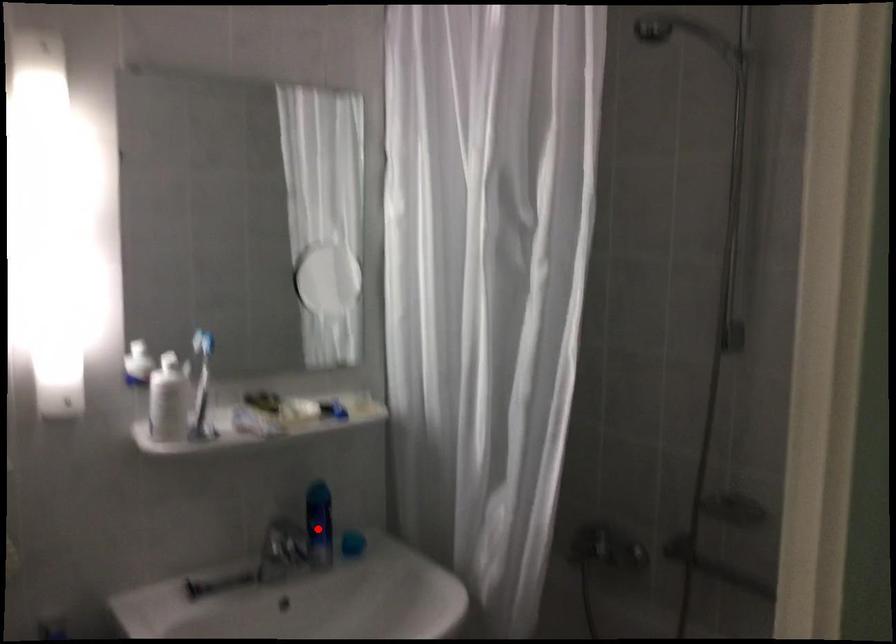
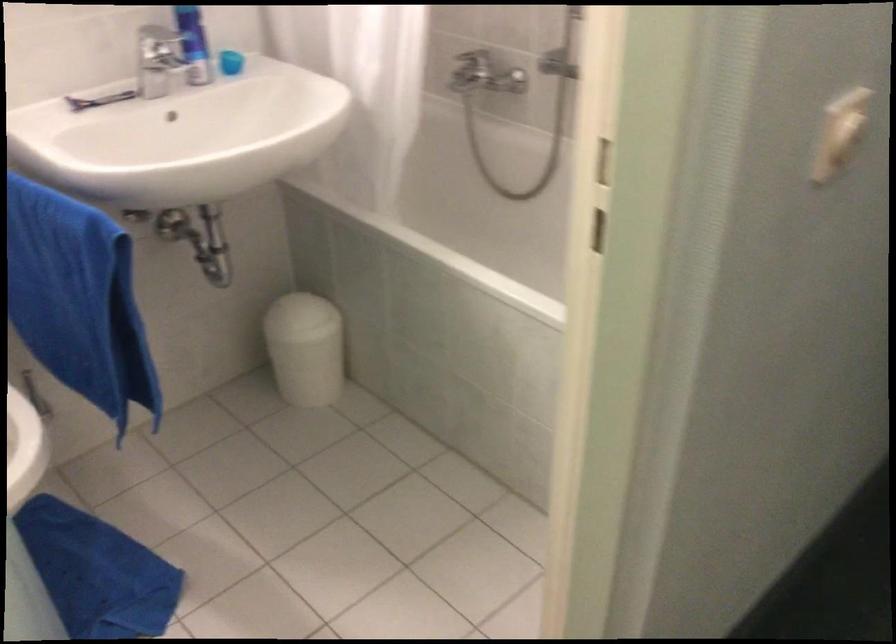
The point at the highlighted location is marked in the first image. Where is the corresponding point in the second image?

(194, 44)